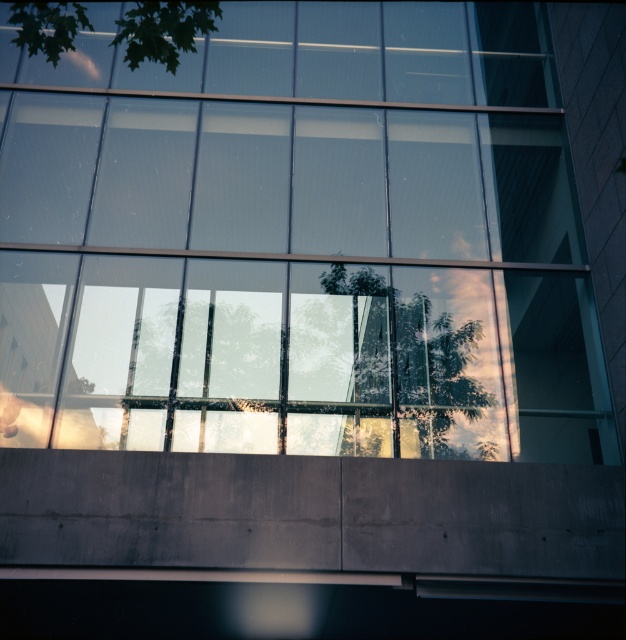
You are an architect designing a new building and want to ensure that the transparent glass window at center receives maximum sunlight. Considering the green leafy tree at upper left, which is positioned above it, how might the tree affect the window?

The green leafy tree at upper left is positioned above the transparent glass window at center, so it may cast shadows on the window, reducing the amount of direct sunlight it receives.

A person is standing at the point marked as point (341, 301). They want to throw a ball to reach the glass window reflection of the tree in the upper left corner. If the distance between them and the target is 9.01 meters, is this achievable if the person can throw up to 10 meters?

The distance between the person at point (341, 301) and the glass window reflection of the tree in the upper left corner is 9.01 meters. Since the person can throw up to 10 meters, they can achieve this throw.

You are standing in front of the modern architectural facade and want to touch both the transparent glass window at center and the green leafy tree at upper left. Which object can you reach first as you move forward?

The transparent glass window at center is closer to you than the green leafy tree at upper left, so you can reach it first as you move forward.